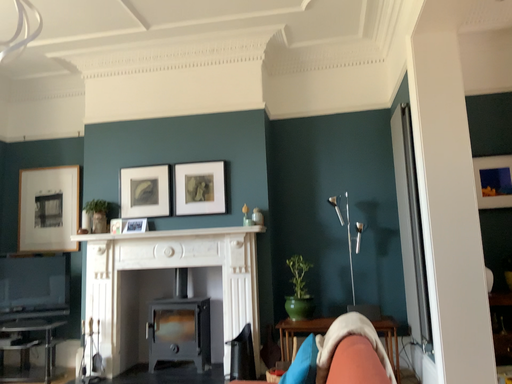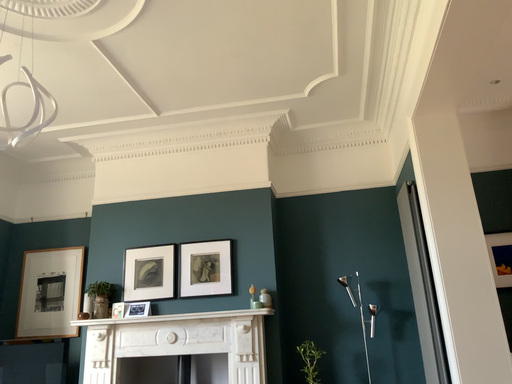
Question: How did the camera likely rotate when shooting the video?

Choices:
 (A) rotated downward
 (B) rotated upward

Answer: (B)